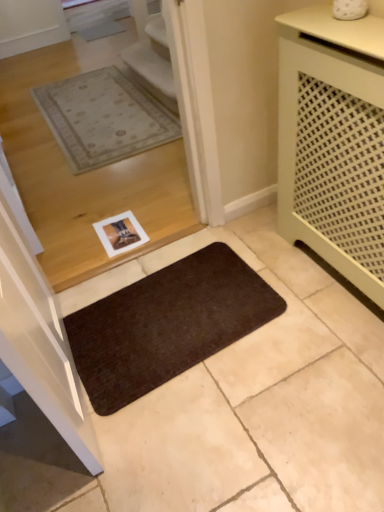
Locate an element on the screen. vacant region below brown matte mat at lower center (from a real-world perspective) is located at coordinates (172, 312).